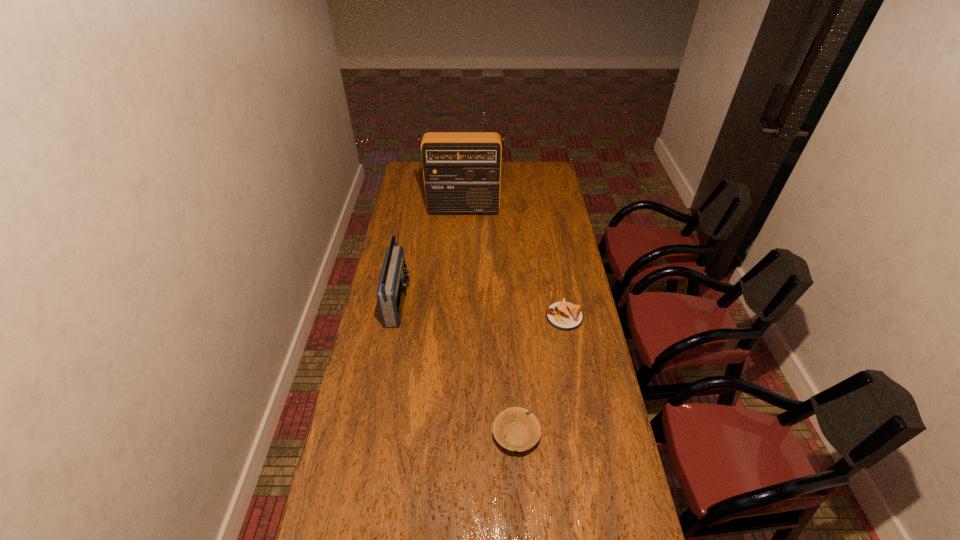
Locate an element on the screen. free space that satisfies the following two spatial constraints: 1. on the front panel of the shorter radio receiver; 2. on the left side of the bowl is located at coordinates (374, 435).

This screenshot has width=960, height=540. What are the coordinates of `vacant space that satisfies the following two spatial constraints: 1. on the front-facing side of the farthest object; 2. on the right side of the shortest object` in the screenshot? It's located at (458, 316).

Locate an element on the screen. This screenshot has height=540, width=960. vacant space that satisfies the following two spatial constraints: 1. on the front-facing side of the shortest object; 2. on the right side of the right radio receiver is located at coordinates (458, 316).

You are a GUI agent. You are given a task and a screenshot of the screen. Output one action in this format:
    pyautogui.click(x=<x>, y=<y>)
    Task: Click on the free space that satisfies the following two spatial constraints: 1. on the back side of the shortest object; 2. on the front panel of the shorter radio receiver
    Image resolution: width=960 pixels, height=540 pixels.
    Given the screenshot: What is the action you would take?
    pyautogui.click(x=562, y=303)

Locate an element on the screen. The height and width of the screenshot is (540, 960). vacant area that satisfies the following two spatial constraints: 1. on the front-facing side of the farthest object; 2. on the front panel of the second tallest object is located at coordinates (459, 303).

Where is `free space that satisfies the following two spatial constraints: 1. on the front panel of the shorter radio receiver; 2. on the right side of the rightmost object`? Image resolution: width=960 pixels, height=540 pixels. free space that satisfies the following two spatial constraints: 1. on the front panel of the shorter radio receiver; 2. on the right side of the rightmost object is located at coordinates (396, 316).

At what (x,y) coordinates should I click in order to perform the action: click on free space in the image that satisfies the following two spatial constraints: 1. on the front-facing side of the bowl; 2. on the right side of the right radio receiver. Please return your answer as a coordinate pair (x, y). This screenshot has height=540, width=960. Looking at the image, I should click on (453, 435).